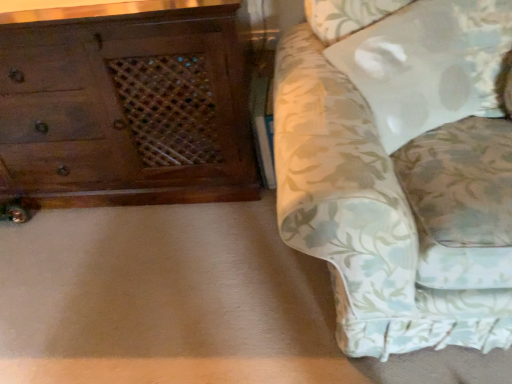
Measure the distance between point (425,96) and camera.

3.96 feet.

Image resolution: width=512 pixels, height=384 pixels. What do you see at coordinates (428, 64) in the screenshot? I see `white fabric pillow at upper right` at bounding box center [428, 64].

Describe the element at coordinates (400, 168) in the screenshot. I see `floral fabric couch at right` at that location.

I want to click on white fabric pillow at upper right, so click(x=428, y=64).

Is wooden chest of drawers at left not within floral fabric couch at right?

That's correct, wooden chest of drawers at left is outside of floral fabric couch at right.

Considering the relative sizes of wooden chest of drawers at left and floral fabric couch at right in the image provided, is wooden chest of drawers at left smaller than floral fabric couch at right?

Yes, wooden chest of drawers at left is smaller than floral fabric couch at right.

Can you tell me how much wooden chest of drawers at left and floral fabric couch at right differ in facing direction?

The facing directions of wooden chest of drawers at left and floral fabric couch at right are 2.65 degrees apart.

Is white fabric pillow at upper right inside or outside of wooden chest of drawers at left?

white fabric pillow at upper right is located beyond the bounds of wooden chest of drawers at left.

Is white fabric pillow at upper right at the right side of wooden chest of drawers at left?

Yes.

Is white fabric pillow at upper right positioned with its back to wooden chest of drawers at left?

That's right, white fabric pillow at upper right is facing away from wooden chest of drawers at left.

Who is more distant, white fabric pillow at upper right or wooden chest of drawers at left?

wooden chest of drawers at left is further from the camera.

Is white fabric pillow at upper right not near floral fabric couch at right?

No.

Can floral fabric couch at right be found inside white fabric pillow at upper right?

Definitely not — floral fabric couch at right is not inside white fabric pillow at upper right.

From the image's perspective, which one is positioned higher, white fabric pillow at upper right or floral fabric couch at right?

From the image's view, white fabric pillow at upper right is above.

Which object is positioned more to the right, white fabric pillow at upper right or floral fabric couch at right?

From the viewer's perspective, floral fabric couch at right appears more on the right side.

From the image's perspective, is wooden chest of drawers at left under white fabric pillow at upper right?

No, from the image's perspective, wooden chest of drawers at left is not below white fabric pillow at upper right.

Which point is more distant from viewer, (203, 174) or (380, 46)?

Positioned behind is point (203, 174).

Consider the image. Is white fabric pillow at upper right completely or partially inside wooden chest of drawers at left?

No, white fabric pillow at upper right is not inside wooden chest of drawers at left.

Between floral fabric couch at right and white fabric pillow at upper right, which one has smaller width?

With smaller width is white fabric pillow at upper right.

Considering the sizes of objects floral fabric couch at right and white fabric pillow at upper right in the image provided, who is shorter, floral fabric couch at right or white fabric pillow at upper right?

Standing shorter between the two is white fabric pillow at upper right.

Is floral fabric couch at right oriented towards white fabric pillow at upper right?

Yes, floral fabric couch at right is turned towards white fabric pillow at upper right.

In the scene shown: Is floral fabric couch at right to the left of white fabric pillow at upper right from the viewer's perspective?

No.

Is floral fabric couch at right not close to wooden chest of drawers at left?

They are positioned close to each other.

In the scene shown: Is floral fabric couch at right taller or shorter than wooden chest of drawers at left?

In the image, floral fabric couch at right appears to be taller than wooden chest of drawers at left.

Can you tell me how much floral fabric couch at right and wooden chest of drawers at left differ in facing direction?

There is a 2.65-degree angle between the facing directions of floral fabric couch at right and wooden chest of drawers at left.

Is floral fabric couch at right positioned before wooden chest of drawers at left?

Yes, floral fabric couch at right is in front of wooden chest of drawers at left.

Identify the location of chest of drawers behind the floral fabric couch at right. (125, 111).

In the image, there is a white fabric pillow at upper right. In order to click on the chest of drawers above it (from the image's perspective) in this screenshot , I will do `click(125, 111)`.

Considering their positions, is wooden chest of drawers at left positioned closer to floral fabric couch at right than white fabric pillow at upper right?

The object closer to floral fabric couch at right is white fabric pillow at upper right.

Consider the image. When comparing their distances from white fabric pillow at upper right, does floral fabric couch at right or wooden chest of drawers at left seem closer?

The object closer to white fabric pillow at upper right is floral fabric couch at right.

Which object lies further to the anchor point wooden chest of drawers at left, white fabric pillow at upper right or floral fabric couch at right?

white fabric pillow at upper right.

Which object lies nearer to the anchor point floral fabric couch at right, white fabric pillow at upper right or wooden chest of drawers at left?

The object closer to floral fabric couch at right is white fabric pillow at upper right.

Which object lies further to the anchor point white fabric pillow at upper right, wooden chest of drawers at left or floral fabric couch at right?

wooden chest of drawers at left lies further to white fabric pillow at upper right than the other object.

Based on their spatial positions, is floral fabric couch at right or white fabric pillow at upper right closer to wooden chest of drawers at left?

floral fabric couch at right is positioned closer to the anchor wooden chest of drawers at left.

Locate an element on the screen. pillow between wooden chest of drawers at left and floral fabric couch at right from left to right is located at coordinates (428, 64).